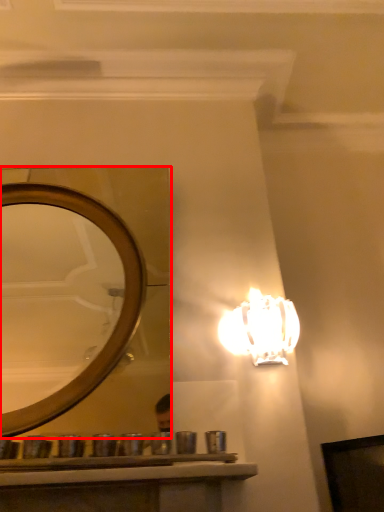
Question: From the image's perspective, where is mirror (annotated by the red box) located in relation to lamp in the image?

Choices:
 (A) below
 (B) above

Answer: (B)